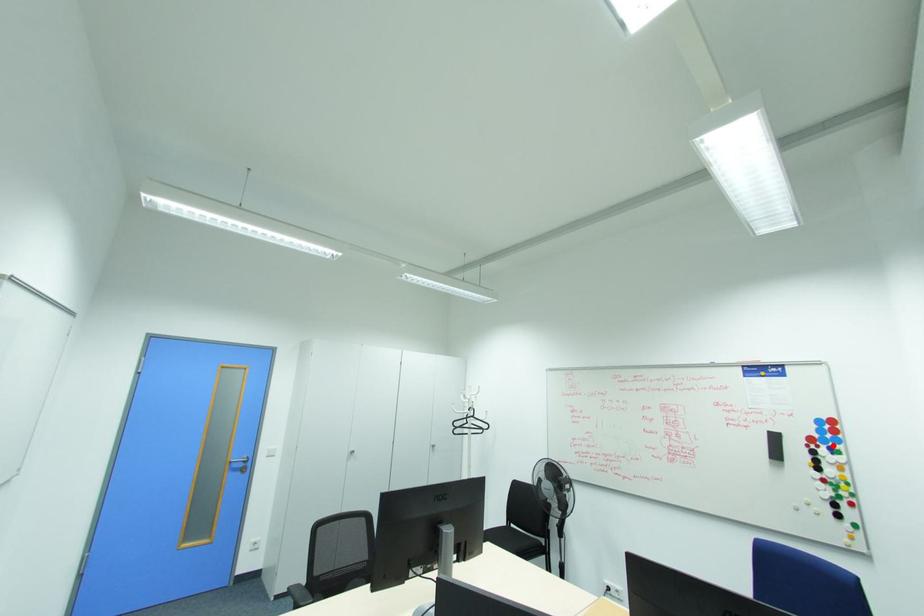
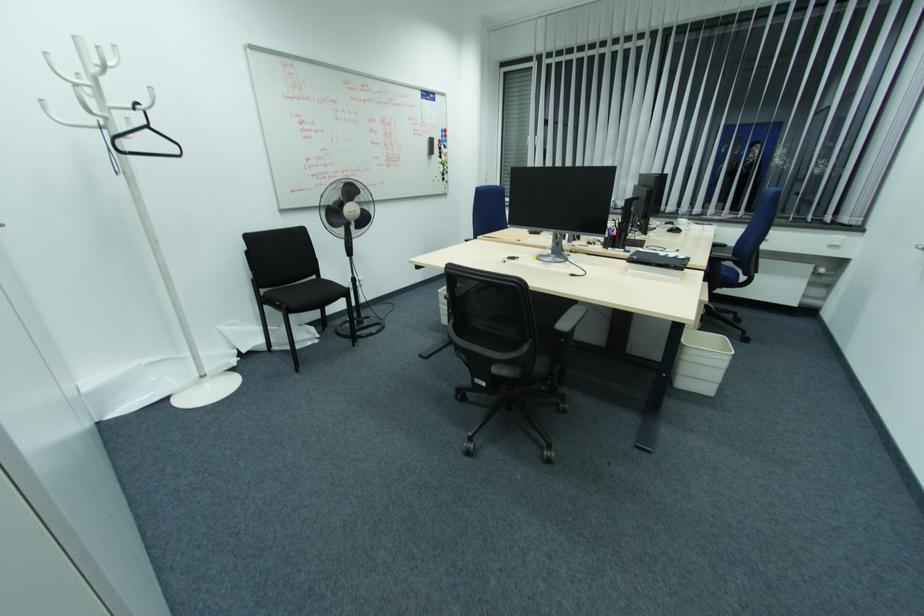
Question: I am providing you with two images of the same scene from different viewpoints. Given a red point in image1, look at the same physical point in image2. Is it:

Choices:
 (A) Closer to the viewpoint
 (B) Farther from the viewpoint

Answer: (A)